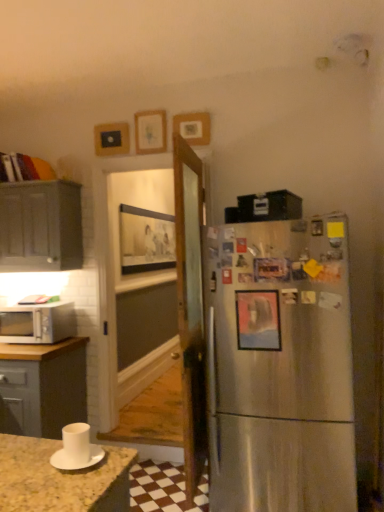
Question: Is white matte cup at lower left positioned in front of wooden picture frame at upper center, the fifth picture frame from the bottom?

Choices:
 (A) yes
 (B) no

Answer: (A)

Question: From a real-world perspective, is white matte cup at lower left beneath wooden picture frame at upper center, marked as the 3th picture frame in a front-to-back arrangement?

Choices:
 (A) yes
 (B) no

Answer: (A)

Question: Does white matte cup at lower left appear on the left side of wooden picture frame at upper center, the first picture frame when ordered from top to bottom?

Choices:
 (A) no
 (B) yes

Answer: (B)

Question: Is white matte cup at lower left not close to wooden picture frame at upper center, arranged as the third picture frame when viewed from the back?

Choices:
 (A) yes
 (B) no

Answer: (A)

Question: Is white matte cup at lower left positioned with its back to wooden picture frame at upper center, marked as the 3th picture frame in a front-to-back arrangement?

Choices:
 (A) no
 (B) yes

Answer: (A)

Question: Is white matte cup at lower left positioned behind wooden picture frame at upper center, the first picture frame when ordered from top to bottom?

Choices:
 (A) yes
 (B) no

Answer: (B)

Question: Is the depth of metallic silver picture frame at right, the fifth picture frame positioned from the back, less than that of wooden picture frame at upper center, the 2th picture frame in the front-to-back sequence?

Choices:
 (A) no
 (B) yes

Answer: (B)

Question: Can you confirm if metallic silver picture frame at right, which is the first picture frame in front-to-back order, is bigger than wooden picture frame at upper center, the fourth picture frame in the back-to-front sequence?

Choices:
 (A) no
 (B) yes

Answer: (A)

Question: From a real-world perspective, is metallic silver picture frame at right, the fifth picture frame positioned from the back, positioned over wooden picture frame at upper center, the second picture frame positioned from the top, based on gravity?

Choices:
 (A) no
 (B) yes

Answer: (A)

Question: Considering the relative sizes of metallic silver picture frame at right, positioned as the first picture frame in bottom-to-top order, and wooden picture frame at upper center, the fourth picture frame positioned from the bottom, in the image provided, is metallic silver picture frame at right, positioned as the first picture frame in bottom-to-top order, taller than wooden picture frame at upper center, the fourth picture frame positioned from the bottom,?

Choices:
 (A) yes
 (B) no

Answer: (A)

Question: From the image's perspective, is metallic silver picture frame at right, which is the first picture frame in front-to-back order, located beneath wooden picture frame at upper center, the 2th picture frame in the front-to-back sequence?

Choices:
 (A) no
 (B) yes

Answer: (B)

Question: Is metallic silver picture frame at right, which is the first picture frame in front-to-back order, far from wooden picture frame at upper center, the fourth picture frame in the back-to-front sequence?

Choices:
 (A) yes
 (B) no

Answer: (A)

Question: Is matte gray cabinet at left shorter than wooden picture frame at upper center, the fifth picture frame from the bottom?

Choices:
 (A) no
 (B) yes

Answer: (A)